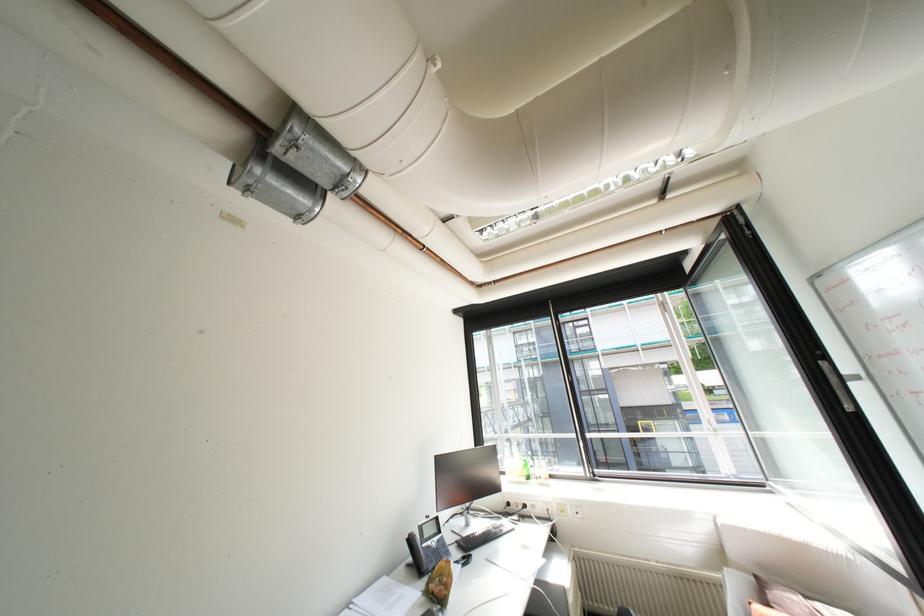
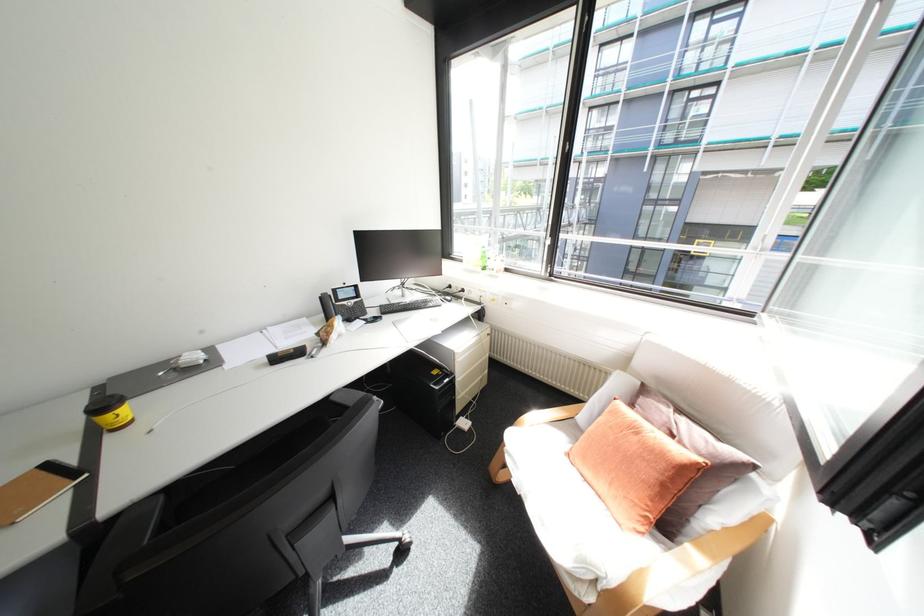
Find the pixel in the second image that matches point 530,475 in the first image.

(487, 265)